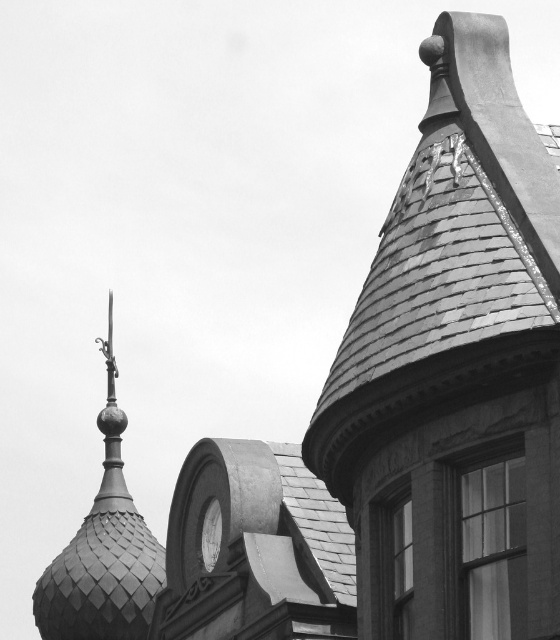
You are standing below the building and looking up. You notice the polished metal spire at upper left and the white glossy clock at center. Which object is positioned higher in the image?

The polished metal spire at upper left is located above the white glossy clock at center, so it is positioned higher in the image.

You are standing in front of the building and notice two points marked on the photograph. The first point is located at coordinates point (423, 214) and the second at point (109, 468). Which point is nearer to your viewpoint?

Point (423, 214) is closer to the viewer than point (109, 468) according to the description.

You are an architect analyzing the building structure. You notice the shiny gray slate roof at upper right and the polished metal spire at upper left. Which of these two objects is positioned more to the east if the photograph was taken facing north?

The shiny gray slate roof at upper right is to the right of the polished metal spire at upper left. Since the photograph was taken facing north, the right side of the image corresponds to the east direction. Therefore, the shiny gray slate roof at upper right is positioned more to the east.